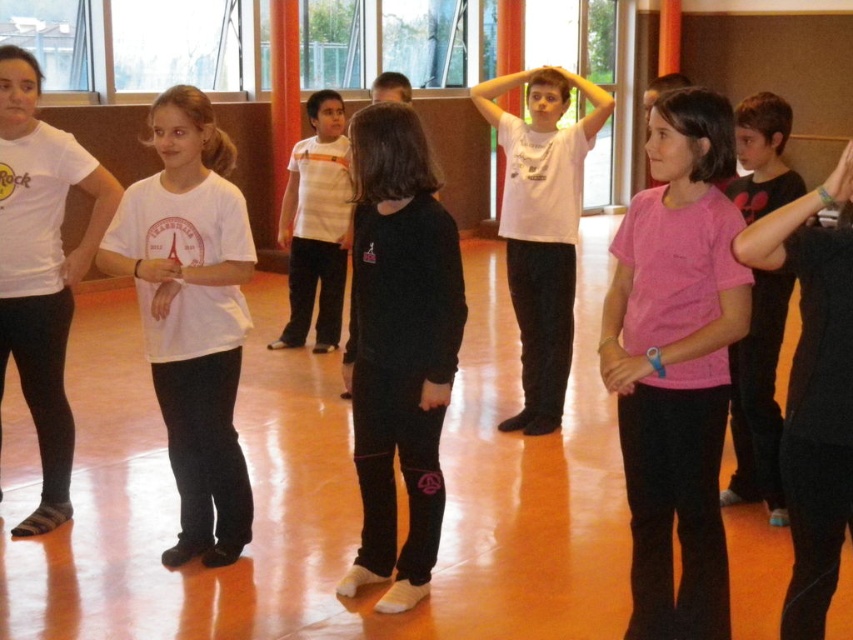
Question: Which of the following is the farthest from the observer?

Choices:
 (A) (566, 253)
 (B) (712, 488)

Answer: (A)

Question: Does black matte pants at center appear over white matte shirt at left?

Choices:
 (A) yes
 (B) no

Answer: (B)

Question: Based on their relative distances, which object is nearer to the white matte t-shirt at center?

Choices:
 (A) white matte shirt at left
 (B) white matte shirt at center
 (C) pink matte shirt at center

Answer: (B)

Question: Observing the image, what is the correct spatial positioning of white matte t-shirt at center in reference to white matte shirt at center?

Choices:
 (A) above
 (B) below

Answer: (B)

Question: Does pink matte shirt at center have a greater width compared to white matte t-shirt at center?

Choices:
 (A) no
 (B) yes

Answer: (A)

Question: Which of the following is the closest to the observer?

Choices:
 (A) white matte shirt at left
 (B) white matte shirt at center

Answer: (A)